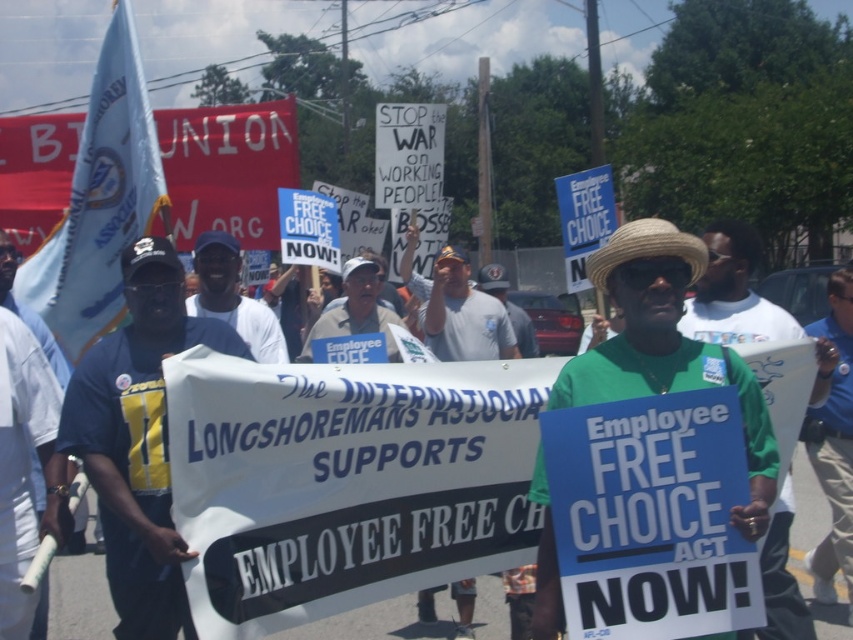
Question: Which point is closer to the camera taking this photo?

Choices:
 (A) (390, 340)
 (B) (83, 355)
 (C) (561, 380)

Answer: (C)

Question: Which object is positioned closest to the blue shirt at center?

Choices:
 (A) blue fabric sign at center
 (B) navy blue shirt at left
 (C) green straw hat at center

Answer: (C)

Question: Observing the image, what is the correct spatial positioning of navy blue shirt at left in reference to blue fabric sign at center?

Choices:
 (A) right
 (B) left

Answer: (B)

Question: Which of the following is the closest to the observer?

Choices:
 (A) white baseball cap at center
 (B) blue shirt at center
 (C) navy blue shirt at left
 (D) green fabric shirt at center

Answer: (C)

Question: Is navy blue shirt at left above blue fabric sign at center?

Choices:
 (A) yes
 (B) no

Answer: (B)

Question: Considering the relative positions of green fabric shirt at center and blue fabric sign at center in the image provided, where is green fabric shirt at center located with respect to blue fabric sign at center?

Choices:
 (A) above
 (B) below

Answer: (A)